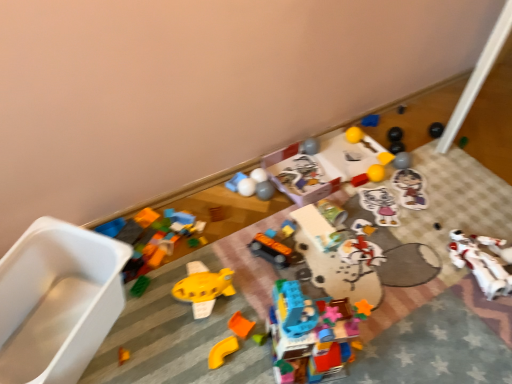
At what (x,y) coordinates should I click in order to perform the action: click on vacant region to the left of white plastic robot at lower right, which appears as the seventeenth toy when viewed from the left. Please return your answer as a coordinate pair (x, y). This screenshot has width=512, height=384. Looking at the image, I should click on 419,267.